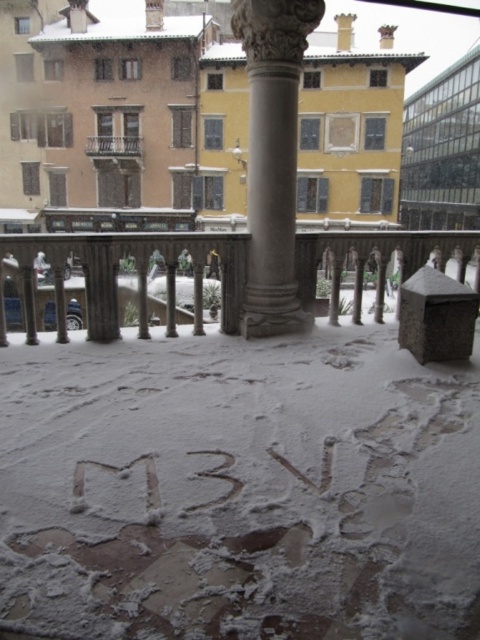
Question: Can you confirm if smooth gray railing at center is positioned to the left of metallic balcony at upper center?

Choices:
 (A) yes
 (B) no

Answer: (B)

Question: Which point is closer to the camera?

Choices:
 (A) (124, 154)
 (B) (176, 333)
 (C) (288, 259)

Answer: (C)

Question: Which object is farther from the camera taking this photo?

Choices:
 (A) smooth gray railing at center
 (B) metallic balcony at upper center

Answer: (B)

Question: Can you confirm if smooth gray railing at center is bigger than metallic balcony at upper center?

Choices:
 (A) no
 (B) yes

Answer: (B)

Question: In this image, where is smooth gray railing at center located relative to metallic balcony at upper center?

Choices:
 (A) right
 (B) left

Answer: (A)

Question: Which of the following is the closest to the observer?

Choices:
 (A) smooth gray railing at center
 (B) metallic balcony at upper center
 (C) polished stone column at center

Answer: (A)